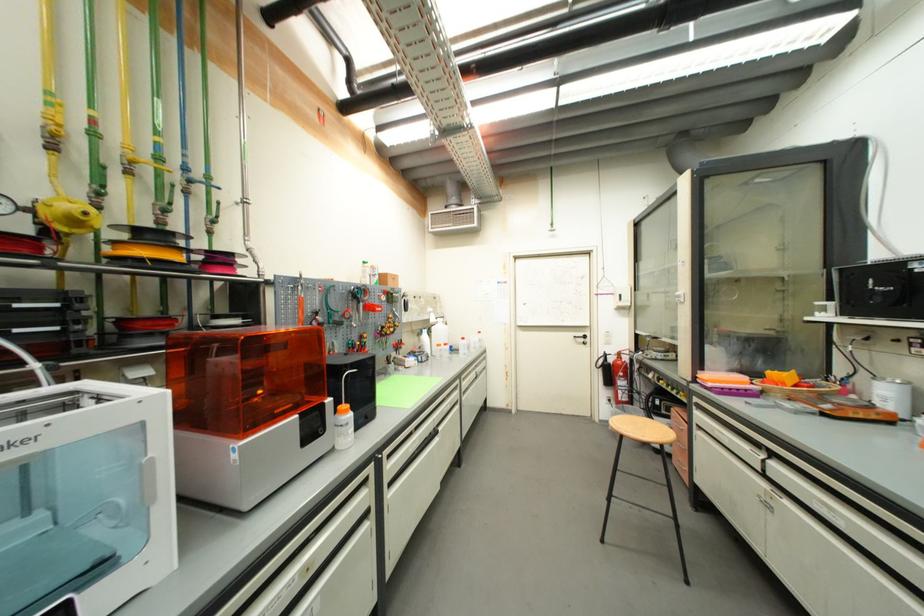
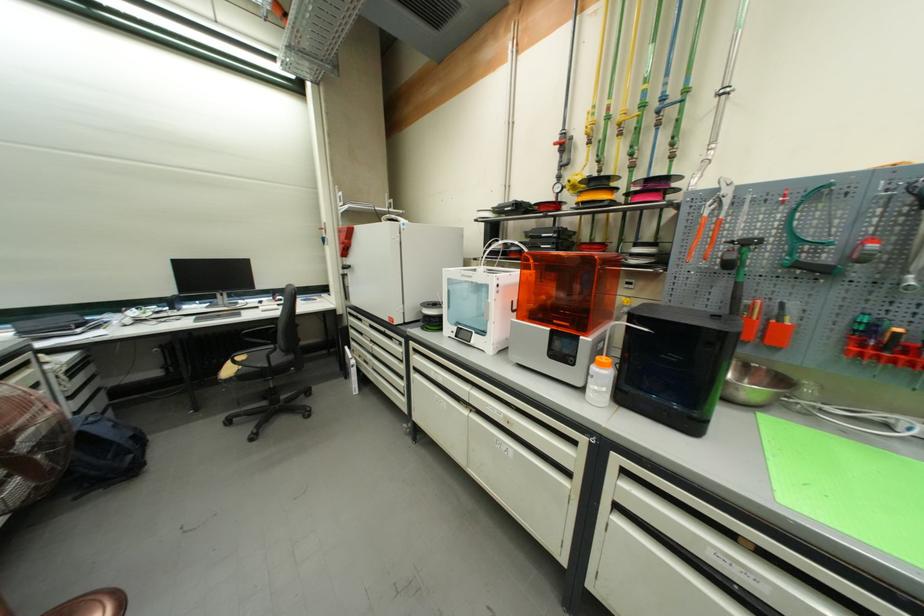
In the second image, find the point that corresponds to pixel 360 371 in the first image.

(651, 331)